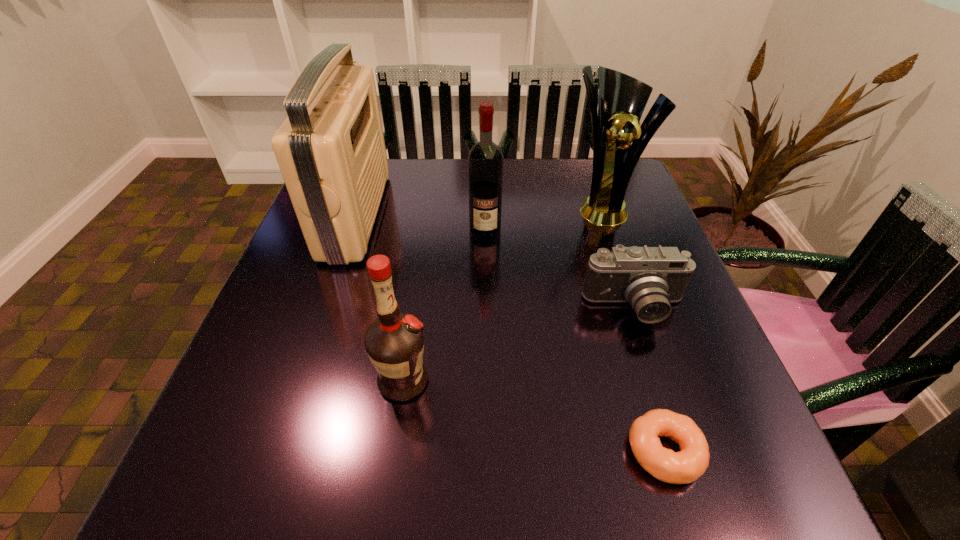
Image resolution: width=960 pixels, height=540 pixels. I want to click on the leftmost object, so click(x=331, y=152).

Identify the location of award. This screenshot has height=540, width=960. (622, 99).

Where is `alcohol`? alcohol is located at coordinates (485, 160).

Find the location of `the fifth farthest object`. the fifth farthest object is located at coordinates (394, 342).

Where is `the second object from left to right`? Image resolution: width=960 pixels, height=540 pixels. the second object from left to right is located at coordinates (394, 342).

The image size is (960, 540). I want to click on the second shortest object, so click(649, 278).

In order to click on the third nearest object in this screenshot , I will do 649,278.

This screenshot has height=540, width=960. I want to click on doughnut, so click(x=687, y=465).

Identify the location of the shortest object. The image size is (960, 540). (687, 465).

The image size is (960, 540). What are the coordinates of `vacant space positioned on the front-facing side of the radio receiver` in the screenshot? It's located at (501, 215).